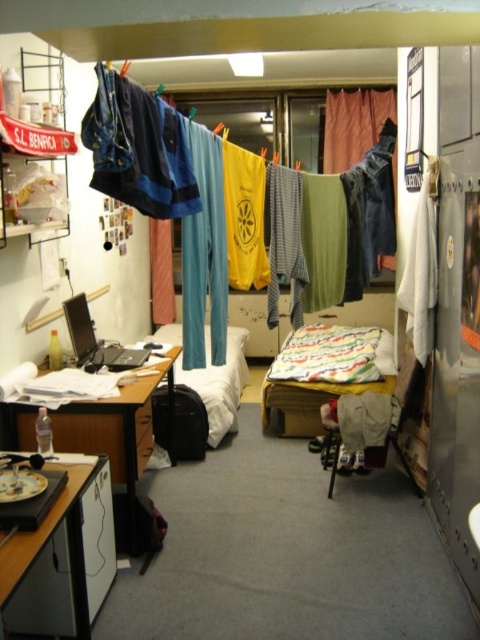
Question: Does yellow fabric clothesline at center appear on the left side of white fabric bed at center?

Choices:
 (A) no
 (B) yes

Answer: (B)

Question: Can you confirm if multicolored quilted bed at center is smaller than yellow fabric clothesline at center?

Choices:
 (A) yes
 (B) no

Answer: (B)

Question: Based on their relative distances, which object is nearer to the white fabric bed at center?

Choices:
 (A) multicolored quilted bed at center
 (B) white glossy table at lower left
 (C) yellow fabric clothesline at center

Answer: (A)

Question: Which point is closer to the camera taking this photo?

Choices:
 (A) (21, 406)
 (B) (326, 372)
 (C) (154, 150)

Answer: (C)

Question: Which of the following is the closest to the observer?

Choices:
 (A) (122, 141)
 (B) (133, 422)
 (C) (34, 618)
 (D) (317, 394)

Answer: (A)

Question: Is white glossy table at lower left positioned behind white fabric bed at center?

Choices:
 (A) yes
 (B) no

Answer: (B)